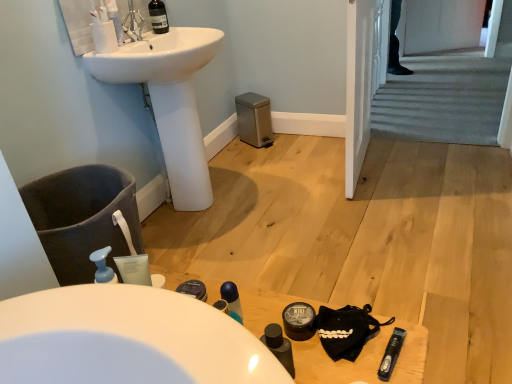
This screenshot has width=512, height=384. Identify the location of vacant area on top of black matte table at lower center (from a real-world perspective). (284, 324).